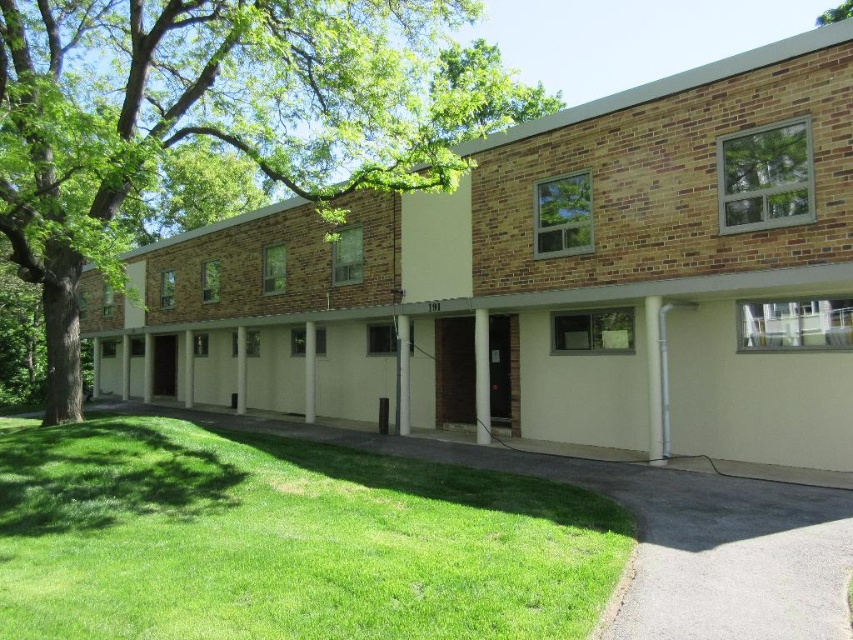
You are standing at the entrance labeled 191 and want to check if the green leafy tree at upper left is within a 30 feet safety zone for parking. Can you confirm?

The green leafy tree at upper left is 30.91 feet away from the viewer, which is slightly beyond the 30 feet safety zone. Therefore, parking there might not be advisable due to the proximity to the tree.

From the picture: You are standing in front of the two story brick building. You see two points marked on the building facade. The first point is at coordinate point (x=434, y=45) and the second is at point (x=827, y=10). Which point is closer to you?

Point (x=434, y=45) is closer to the viewer than point (x=827, y=10).

You are a landscape architect designing a new garden for the area in front of the building. You have two plants to place in the garden. The green grass at lower left and the green leafy tree at upper right. Which plant has a smaller width?

The green grass at lower left is thinner than the green leafy tree at upper right, so the green grass at lower left has a smaller width.